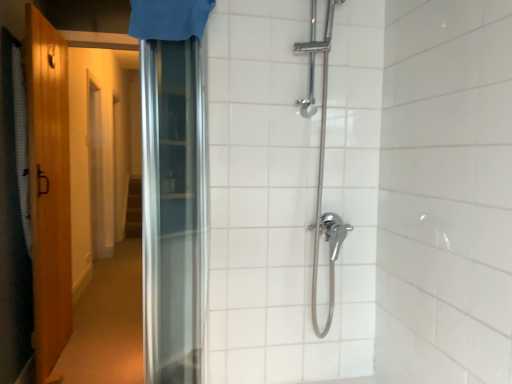
What do you see at coordinates (169, 19) in the screenshot? This screenshot has height=384, width=512. I see `blue fabric shower curtain at upper center, which is the 2th shower curtain from bottom to top` at bounding box center [169, 19].

What is the approximate width of wooden door at left?

wooden door at left is 5.00 inches wide.

Image resolution: width=512 pixels, height=384 pixels. What do you see at coordinates (49, 189) in the screenshot? I see `wooden door at left` at bounding box center [49, 189].

What is the approximate height of white textured shower curtain at left, which is the second shower curtain from right to left?

white textured shower curtain at left, which is the second shower curtain from right to left, is 3.85 feet in height.

At what (x,y) coordinates should I click in order to perform the action: click on blue fabric shower curtain at upper center, the 1th shower curtain when ordered from right to left. Please return your answer as a coordinate pair (x, y). Looking at the image, I should click on (169, 19).

Between blue fabric shower curtain at upper center, which is the 2th shower curtain in back-to-front order, and wooden door at left, which one has smaller size?

With smaller size is blue fabric shower curtain at upper center, which is the 2th shower curtain in back-to-front order.

From a real-world perspective, who is located lower, blue fabric shower curtain at upper center, which is the first shower curtain from front to back, or wooden door at left?

wooden door at left.

Considering the positions of objects blue fabric shower curtain at upper center, which is the 2th shower curtain from bottom to top, and wooden door at left in the image provided, who is more to the right, blue fabric shower curtain at upper center, which is the 2th shower curtain from bottom to top, or wooden door at left?

blue fabric shower curtain at upper center, which is the 2th shower curtain from bottom to top, is more to the right.

Is white textured shower curtain at left, which is the second shower curtain from right to left, in front of or behind blue fabric shower curtain at upper center, the 2th shower curtain positioned from the left, in the image?

In the image, white textured shower curtain at left, which is the second shower curtain from right to left, appears behind blue fabric shower curtain at upper center, the 2th shower curtain positioned from the left.

Between point (19, 122) and point (204, 7), which one is positioned in front?

The point (204, 7) is in front.

From a real-world perspective, which object rests below the other?

white textured shower curtain at left, arranged as the 2th shower curtain when viewed from the front.

Which of these two, white textured shower curtain at left, arranged as the 2th shower curtain when viewed from the top, or blue fabric shower curtain at upper center, the 1th shower curtain when ordered from right to left, is bigger?

white textured shower curtain at left, arranged as the 2th shower curtain when viewed from the top, is bigger.

What's the angular difference between white textured shower curtain at left, arranged as the 2th shower curtain when viewed from the front, and wooden door at left's facing directions?

They differ by 0.00599 degrees in their facing directions.

From the picture: Considering the sizes of objects white textured shower curtain at left, acting as the 1th shower curtain starting from the bottom, and wooden door at left in the image provided, who is thinner, white textured shower curtain at left, acting as the 1th shower curtain starting from the bottom, or wooden door at left?

With smaller width is white textured shower curtain at left, acting as the 1th shower curtain starting from the bottom.

Is white textured shower curtain at left, the first shower curtain when ordered from back to front, to the left of wooden door at left from the viewer's perspective?

Yes, white textured shower curtain at left, the first shower curtain when ordered from back to front, is to the left of wooden door at left.

Is point (25, 243) closer or farther from the camera than point (24, 64)?

Point (25, 243) is farther from the camera than point (24, 64).

Choose the correct answer: Is wooden door at left inside white textured shower curtain at left, the 1th shower curtain positioned from the left, or outside it?

wooden door at left is outside white textured shower curtain at left, the 1th shower curtain positioned from the left.

From the image's perspective, which object appears higher, wooden door at left or white textured shower curtain at left, the first shower curtain when ordered from back to front?

From the image's view, white textured shower curtain at left, the first shower curtain when ordered from back to front, is above.

Consider the image. Is wooden door at left placed right next to white textured shower curtain at left, acting as the 1th shower curtain starting from the bottom?

No, wooden door at left is not beside white textured shower curtain at left, acting as the 1th shower curtain starting from the bottom.

Looking at the image, does wooden door at left seem bigger or smaller compared to white textured shower curtain at left, acting as the 1th shower curtain starting from the bottom?

Clearly, wooden door at left is larger in size than white textured shower curtain at left, acting as the 1th shower curtain starting from the bottom.

This screenshot has height=384, width=512. I want to click on shower curtain that is on the right side of white textured shower curtain at left, acting as the 1th shower curtain starting from the bottom, so click(x=169, y=19).

Relative to white textured shower curtain at left, the 1th shower curtain positioned from the left, is blue fabric shower curtain at upper center, which is the 1th shower curtain in top-to-bottom order, in front or behind?

Clearly, blue fabric shower curtain at upper center, which is the 1th shower curtain in top-to-bottom order, is in front of white textured shower curtain at left, the 1th shower curtain positioned from the left.

Is white textured shower curtain at left, the first shower curtain when ordered from back to front, a part of blue fabric shower curtain at upper center, the 1th shower curtain when ordered from right to left?

No, blue fabric shower curtain at upper center, the 1th shower curtain when ordered from right to left, does not contain white textured shower curtain at left, the first shower curtain when ordered from back to front.

Is point (134, 22) positioned in front of point (16, 151)?

Yes.

In the scene shown: Is wooden door at left not within blue fabric shower curtain at upper center, which is the first shower curtain from front to back?

Indeed, wooden door at left is completely outside blue fabric shower curtain at upper center, which is the first shower curtain from front to back.

From a real-world perspective, which object stands above the other?

blue fabric shower curtain at upper center, the 1th shower curtain when ordered from right to left, from a real-world perspective.

From the image's perspective, is wooden door at left located above or below blue fabric shower curtain at upper center, which is the first shower curtain from front to back?

Based on their image positions, wooden door at left is located beneath blue fabric shower curtain at upper center, which is the first shower curtain from front to back.

Locate an element on the screen. shower curtain on the right of wooden door at left is located at coordinates (169, 19).

This screenshot has width=512, height=384. I want to click on shower curtain lying on the left of blue fabric shower curtain at upper center, which is the first shower curtain from front to back, so pyautogui.click(x=21, y=142).

Looking at this image, from the image, which object appears to be farther from blue fabric shower curtain at upper center, which is the first shower curtain from front to back, wooden door at left or white textured shower curtain at left, arranged as the 2th shower curtain when viewed from the front?

The object further to blue fabric shower curtain at upper center, which is the first shower curtain from front to back, is wooden door at left.

Consider the image. Considering their positions, is blue fabric shower curtain at upper center, which is the 1th shower curtain in top-to-bottom order, positioned closer to white textured shower curtain at left, the 1th shower curtain positioned from the left, than wooden door at left?

wooden door at left lies closer to white textured shower curtain at left, the 1th shower curtain positioned from the left, than the other object.

Considering their positions, is blue fabric shower curtain at upper center, the 2th shower curtain positioned from the left, positioned further to wooden door at left than white textured shower curtain at left, the first shower curtain when ordered from back to front?

blue fabric shower curtain at upper center, the 2th shower curtain positioned from the left, is further to wooden door at left.

Looking at this image, looking at the image, which one is located closer to white textured shower curtain at left, which is the second shower curtain from right to left, wooden door at left or blue fabric shower curtain at upper center, the 1th shower curtain when ordered from right to left?

wooden door at left.

Considering their positions, is white textured shower curtain at left, the 1th shower curtain positioned from the left, positioned further to wooden door at left than blue fabric shower curtain at upper center, which is the 2th shower curtain in back-to-front order?

The object further to wooden door at left is blue fabric shower curtain at upper center, which is the 2th shower curtain in back-to-front order.

In the scene shown: From the image, which object appears to be nearer to blue fabric shower curtain at upper center, which is the 1th shower curtain in top-to-bottom order, white textured shower curtain at left, arranged as the 2th shower curtain when viewed from the front, or wooden door at left?

white textured shower curtain at left, arranged as the 2th shower curtain when viewed from the front, is positioned closer to the anchor blue fabric shower curtain at upper center, which is the 1th shower curtain in top-to-bottom order.

This screenshot has height=384, width=512. What are the coordinates of `door between white textured shower curtain at left, the first shower curtain when ordered from back to front, and blue fabric shower curtain at upper center, which is the 2th shower curtain in back-to-front order, in the horizontal direction` in the screenshot? It's located at (49, 189).